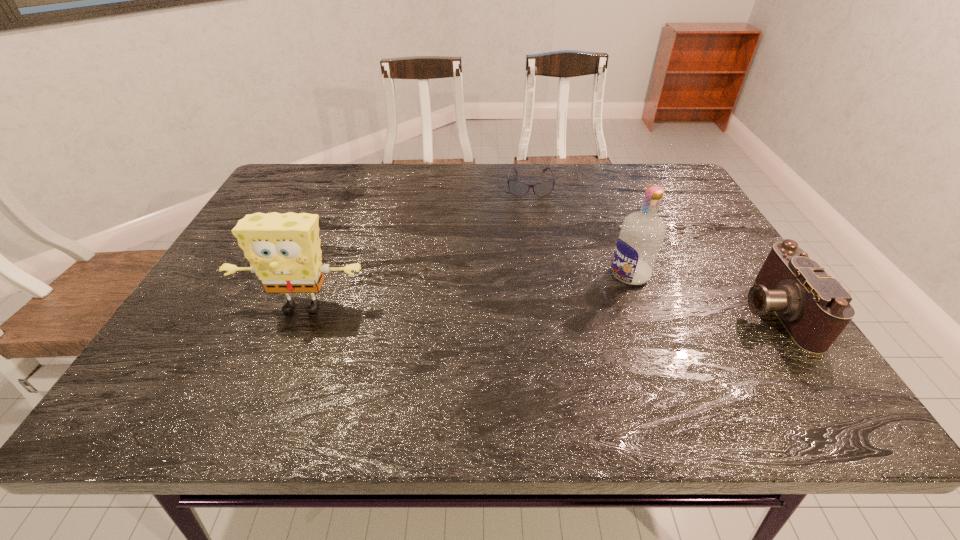
Where is `free spot on the desktop that is between the leftmost object and the rightmost object and is positioned on the lenses of the shortest object`? This screenshot has width=960, height=540. free spot on the desktop that is between the leftmost object and the rightmost object and is positioned on the lenses of the shortest object is located at coordinates (538, 309).

Where is `vacant space on the desktop that is between the sponge and the second shortest object and is positioned on the label of the second object from right to left`? Image resolution: width=960 pixels, height=540 pixels. vacant space on the desktop that is between the sponge and the second shortest object and is positioned on the label of the second object from right to left is located at coordinates (556, 309).